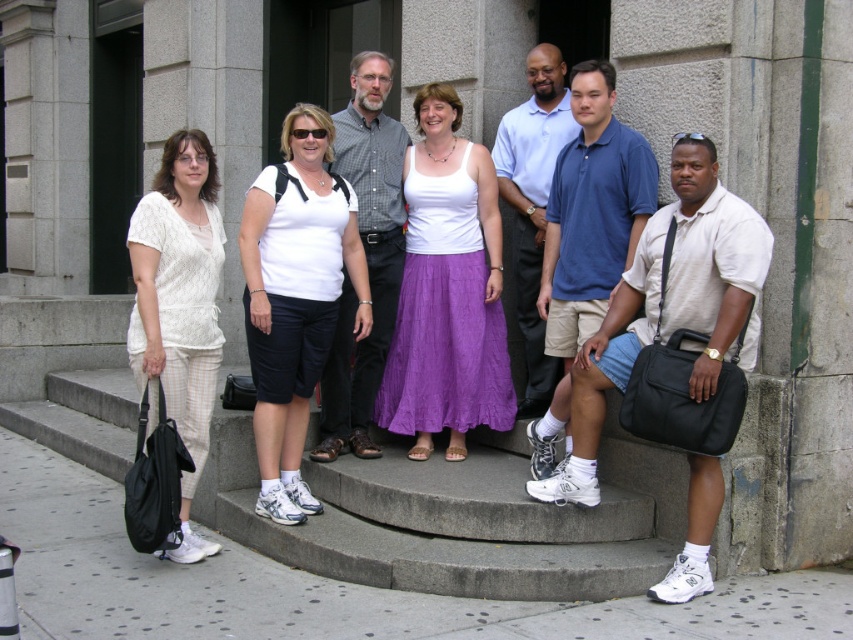
Question: Among these objects, which one is farthest from the camera?

Choices:
 (A) white cotton polo shirt at center
 (B) white cotton shirt at center
 (C) white matte t-shirt at center
 (D) white cotton tank top at center

Answer: (A)

Question: Is white cotton shirt at center above white matte t-shirt at center?

Choices:
 (A) yes
 (B) no

Answer: (B)

Question: Which point is closer to the camera?

Choices:
 (A) (689, 326)
 (B) (167, 268)
 (C) (537, 384)

Answer: (A)

Question: Is white cotton tank top at center to the right of blue cotton polo shirt at center from the viewer's perspective?

Choices:
 (A) no
 (B) yes

Answer: (A)

Question: Which of these objects is positioned farthest from the blue cotton polo shirt at center?

Choices:
 (A) white woven top at left
 (B) white cotton polo shirt at center

Answer: (A)

Question: Is white cotton tank top at center positioned at the back of white cotton polo shirt at center?

Choices:
 (A) no
 (B) yes

Answer: (A)